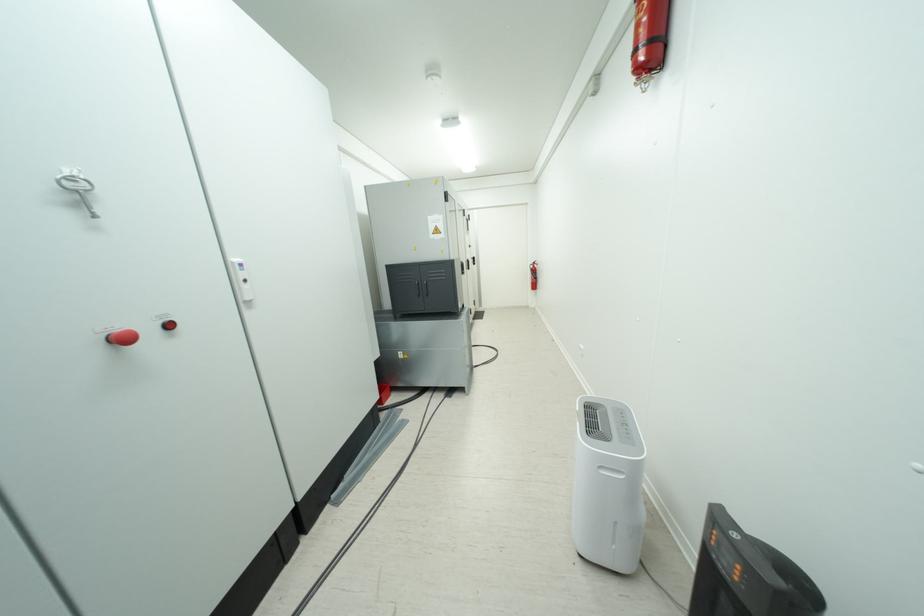
Find the location of `metal key in lock`. metal key in lock is located at coordinates (74, 180).